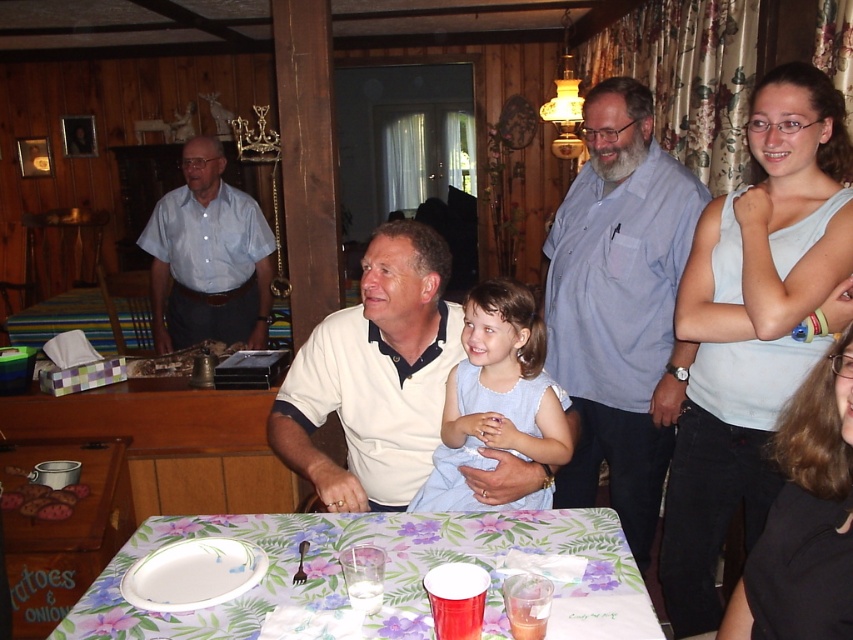
You are a guest at this gathering and want to place a small gift on the table. Considering the size of the floral printed tablecloth at lower center and the white cotton shirt at center, which one has enough space to accommodate the gift?

The white cotton shirt at center is larger than the floral printed tablecloth at lower center, so the gift can be placed on the white cotton shirt at center.

You are standing in the room and want to locate the white cotton shirt at center. Based on the coordinates provided, where would you find it?

The white cotton shirt at center is located at coordinates point [374,376].